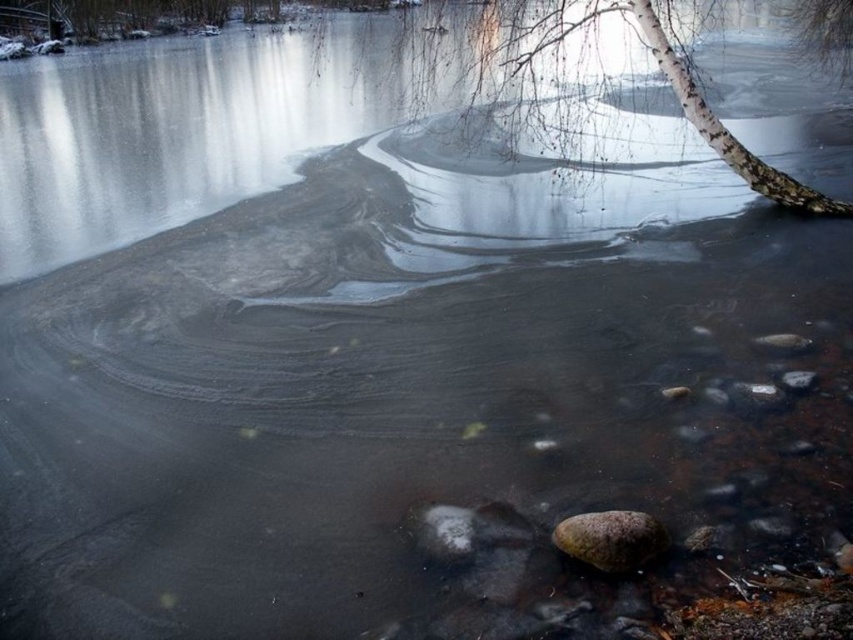
You are standing at the point with coordinates point (606, 529) and want to walk towards point (422, 44). Based on the scene description, will you be moving towards the foreground or the middle ground?

You will be moving towards the middle ground because point (422, 44) is behind point (606, 529), which places it in the middle ground relative to your starting position.

You are standing at the center of the frozen lake and want to reach the white bark tree at upper right. Which direction should you walk to get there?

Since the white bark tree at upper right is located at point 0.080 in the x coordinate and 0.692 in the y coordinate, you should walk towards the upper right direction to reach it.